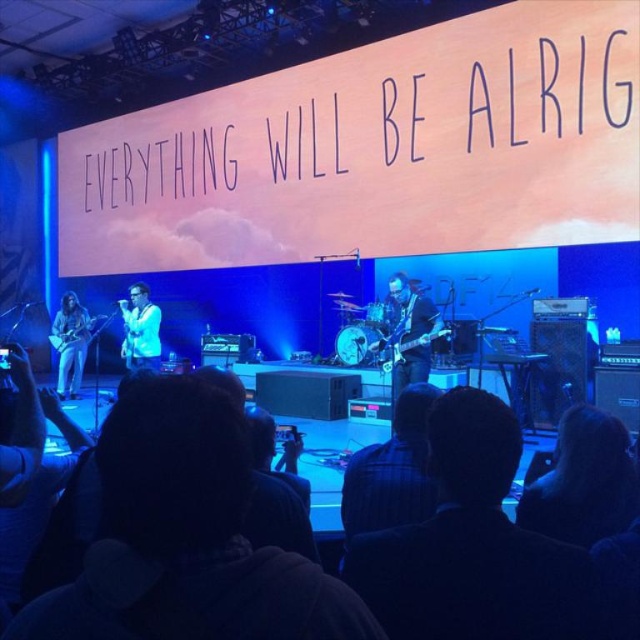
You are a stagehand responsible for adjusting the lighting. The main spotlight needs to be directed towards the white glossy microphone at center. According to the stage coordinates provided, where should you aim the spotlight?

The white glossy microphone at center is located at point (140,330), so you should aim the spotlight at those coordinates to focus on it.